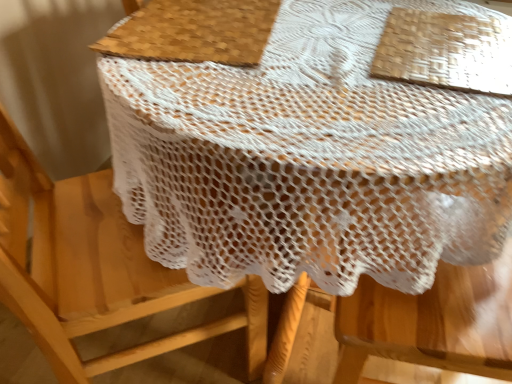
What do you see at coordinates (94, 269) in the screenshot?
I see `wooden chair at upper center` at bounding box center [94, 269].

Where is `wooden chair at upper center`? The image size is (512, 384). wooden chair at upper center is located at coordinates (94, 269).

You are a GUI agent. You are given a task and a screenshot of the screen. Output one action in this format:
    pyautogui.click(x=<x>, y=<y>)
    Task: Click on the wooden chair at upper center
    Image resolution: width=512 pixels, height=384 pixels.
    Given the screenshot: What is the action you would take?
    pyautogui.click(x=94, y=269)